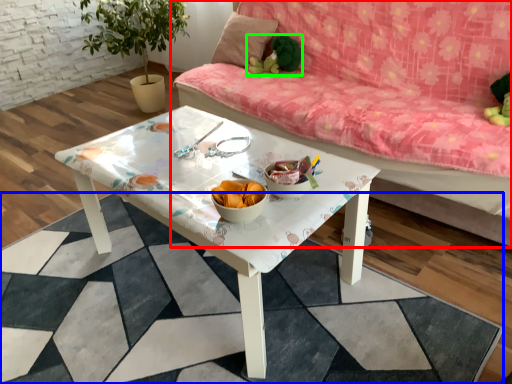
Question: Which object is the closest to the studio couch (highlighted by a red box)? Choose among these: square (highlighted by a blue box) or toy (highlighted by a green box).

Choices:
 (A) square
 (B) toy

Answer: (B)